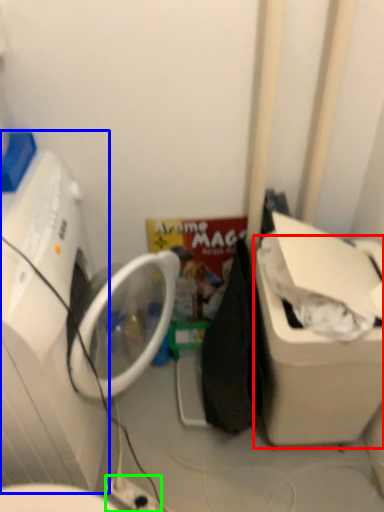
Question: Estimate the real-world distances between objects in this image. Which object is farther from water cooler (highlighted by a red box), washing machine (highlighted by a blue box) or electric outlet (highlighted by a green box)?

Choices:
 (A) washing machine
 (B) electric outlet

Answer: (A)